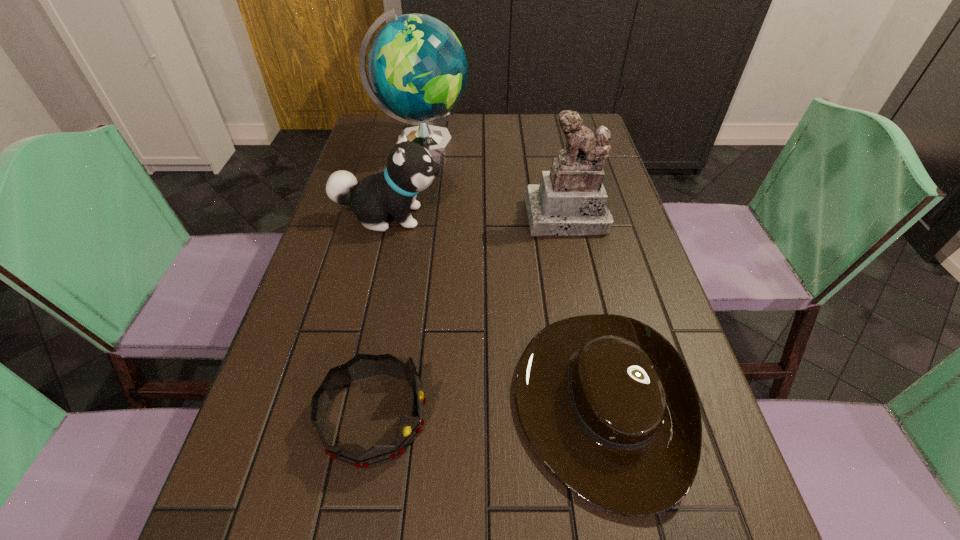
The height and width of the screenshot is (540, 960). Find the location of `free space located on the back of the cowboy hat`. free space located on the back of the cowboy hat is located at coordinates (558, 210).

Find the location of a particular element. object at the far edge is located at coordinates (x=417, y=67).

At what (x,y) coordinates should I click in order to perform the action: click on globe located in the left edge section of the desktop. Please return your answer as a coordinate pair (x, y). Looking at the image, I should click on (417, 67).

Locate an element on the screen. This screenshot has height=540, width=960. puppy that is at the left edge is located at coordinates (410, 169).

This screenshot has height=540, width=960. Identify the location of tiara at the left edge. (361, 366).

Locate an element on the screen. figurine present at the right edge is located at coordinates (571, 200).

The image size is (960, 540). Identify the location of cowboy hat that is at the right edge. (606, 402).

Where is `object situated at the far left corner`? The width and height of the screenshot is (960, 540). object situated at the far left corner is located at coordinates (417, 67).

Locate an element on the screen. The width and height of the screenshot is (960, 540). free space at the far edge of the desktop is located at coordinates (544, 119).

Identify the location of vacant space at the left edge. (356, 312).